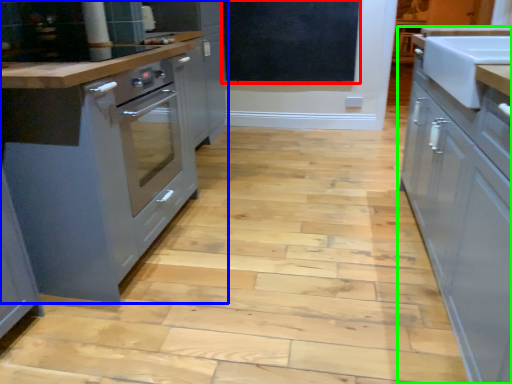
Question: Estimate the real-world distances between objects in this image. Which object is farther from bulletin board (highlighted by a red box), cabinetry (highlighted by a blue box) or cabinetry (highlighted by a green box)?

Choices:
 (A) cabinetry
 (B) cabinetry

Answer: (B)